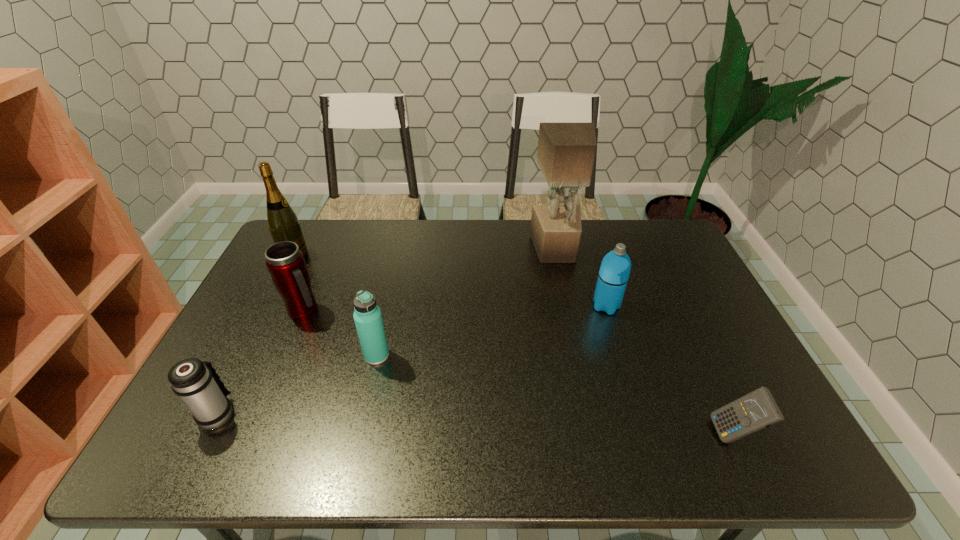
The height and width of the screenshot is (540, 960). Find the location of `vacant position located on the front-facing side of the tallest object`. vacant position located on the front-facing side of the tallest object is located at coordinates (569, 317).

The width and height of the screenshot is (960, 540). What are the coordinates of `vacant space located 0.380m on the front-facing side of the second tallest object` in the screenshot? It's located at (420, 256).

Locate an element on the screen. The width and height of the screenshot is (960, 540). free space located 0.080m on the front of the rightmost thermos bottle is located at coordinates (615, 337).

Locate an element on the screen. vacant space situated 0.180m on the back of the third farthest thermos bottle is located at coordinates (389, 300).

You are a GUI agent. You are given a task and a screenshot of the screen. Output one action in this format:
    pyautogui.click(x=<x>, y=<y>)
    Task: Click on the vacant region located 0.080m on the side with the handle of the third thermos bottle from right to left
    This screenshot has height=540, width=960.
    Given the screenshot: What is the action you would take?
    [x=350, y=312]

Locate an element on the screen. This screenshot has height=540, width=960. free spot located 0.360m on the side with the handle of the nearest thermos bottle is located at coordinates (276, 295).

Locate an element on the screen. The image size is (960, 540). vacant space located 0.220m on the side with the handle of the nearest thermos bottle is located at coordinates (260, 330).

The image size is (960, 540). Identify the location of vacant region located 0.120m on the side with the handle of the nearest thermos bottle. (246, 358).

The width and height of the screenshot is (960, 540). Identify the location of free space located on the front-facing side of the rightmost object. (687, 434).

Where is `free space located 0.250m on the front-facing side of the rightmost object`? The width and height of the screenshot is (960, 540). free space located 0.250m on the front-facing side of the rightmost object is located at coordinates (603, 434).